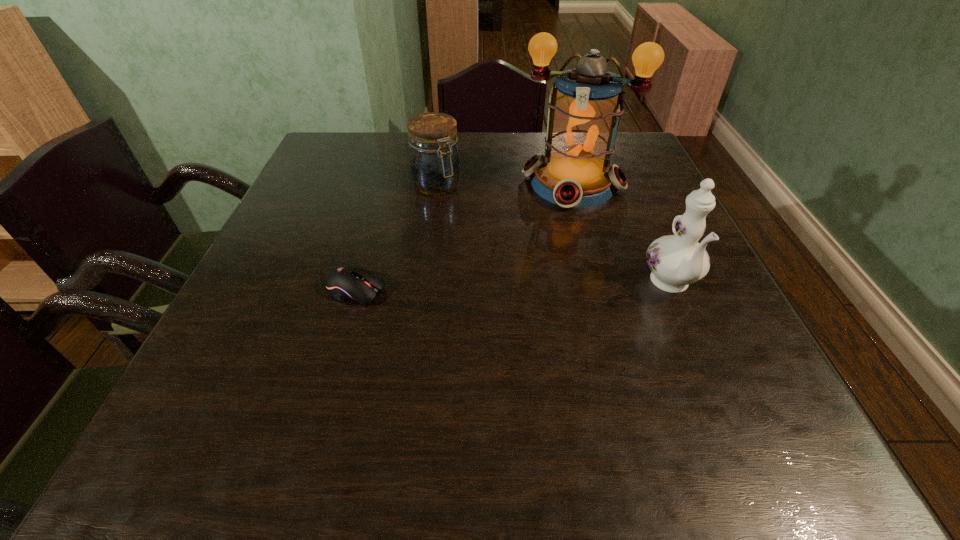
Identify the location of free space between the shortest object and the tallest object. Image resolution: width=960 pixels, height=540 pixels. (465, 237).

Where is `empty space that is in between the second object from left to right and the tallest object`? empty space that is in between the second object from left to right and the tallest object is located at coordinates (504, 185).

Locate an element on the screen. This screenshot has height=540, width=960. empty space between the lantern and the third tallest object is located at coordinates (504, 185).

Where is `free space between the computer mouse and the third tallest object`? The height and width of the screenshot is (540, 960). free space between the computer mouse and the third tallest object is located at coordinates (396, 238).

Find the location of a particular element. The image size is (960, 540). empty space that is in between the lantern and the third object from right to left is located at coordinates (504, 185).

Locate an element on the screen. the second closest object to the lantern is located at coordinates (676, 261).

Identify the location of the third closest object to the third tallest object. This screenshot has width=960, height=540. (676, 261).

The width and height of the screenshot is (960, 540). What are the coordinates of `free space that satisfies the following two spatial constraints: 1. on the back side of the jar; 2. on the right side of the tallest object` in the screenshot? It's located at (437, 184).